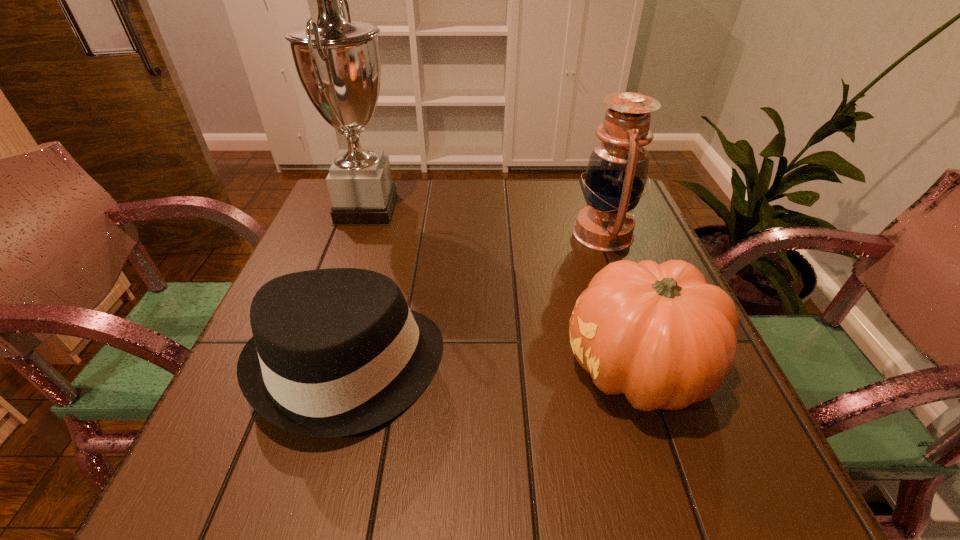
Where is `vacant point at the far edge`? Image resolution: width=960 pixels, height=540 pixels. vacant point at the far edge is located at coordinates (540, 206).

This screenshot has width=960, height=540. In the image, there is a desktop. What are the coordinates of `vacant space at the near edge` in the screenshot? It's located at (616, 457).

What are the coordinates of `vacant space at the left edge of the desktop` in the screenshot? It's located at (304, 241).

Locate an element on the screen. blank space at the near left corner is located at coordinates [252, 498].

This screenshot has height=540, width=960. Find the location of `vacant space at the near right corner of the desktop`. vacant space at the near right corner of the desktop is located at coordinates (667, 451).

Find the location of `empty space between the shortest object and the second tallest object`. empty space between the shortest object and the second tallest object is located at coordinates (476, 300).

Identify the location of unoccupied position between the fedora and the pumpkin. (493, 368).

You are a GUI agent. You are given a task and a screenshot of the screen. Output one action in this format:
    pyautogui.click(x=<x>, y=<y>)
    Task: Click on the vacant area that lies between the pumpkin and the trophy cup
    Image resolution: width=960 pixels, height=540 pixels.
    Given the screenshot: What is the action you would take?
    pyautogui.click(x=502, y=289)

The width and height of the screenshot is (960, 540). I want to click on free space between the fedora and the pumpkin, so click(493, 368).

The width and height of the screenshot is (960, 540). Identify the location of vacant space that's between the pumpkin and the fedora. (493, 368).